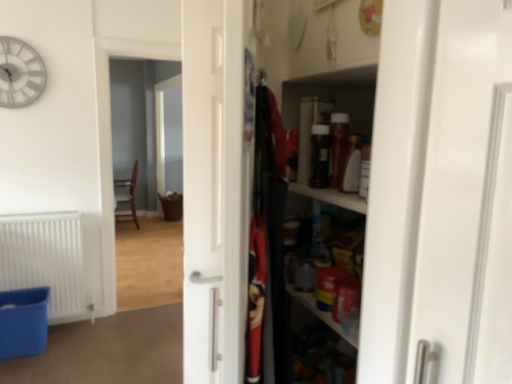
Question: From a real-world perspective, is wooden chair at center on top of brown woven basket at center?

Choices:
 (A) no
 (B) yes

Answer: (A)

Question: Can you confirm if wooden chair at center is wider than brown woven basket at center?

Choices:
 (A) no
 (B) yes

Answer: (B)

Question: Is wooden chair at center further to the viewer compared to brown woven basket at center?

Choices:
 (A) yes
 (B) no

Answer: (B)

Question: Is wooden chair at center to the left of brown woven basket at center from the viewer's perspective?

Choices:
 (A) yes
 (B) no

Answer: (B)

Question: From the image's perspective, would you say wooden chair at center is positioned over brown woven basket at center?

Choices:
 (A) yes
 (B) no

Answer: (B)

Question: Is wooden chair at center not inside brown woven basket at center?

Choices:
 (A) yes
 (B) no

Answer: (A)

Question: Can you confirm if brown woven basket at center is bigger than blue plastic laundry basket at lower left?

Choices:
 (A) no
 (B) yes

Answer: (B)

Question: Does brown woven basket at center come behind blue plastic laundry basket at lower left?

Choices:
 (A) yes
 (B) no

Answer: (A)

Question: From the image's perspective, is brown woven basket at center below blue plastic laundry basket at lower left?

Choices:
 (A) no
 (B) yes

Answer: (A)

Question: Does brown woven basket at center have a lesser width compared to blue plastic laundry basket at lower left?

Choices:
 (A) yes
 (B) no

Answer: (A)

Question: From a real-world perspective, does brown woven basket at center sit lower than blue plastic laundry basket at lower left?

Choices:
 (A) yes
 (B) no

Answer: (B)

Question: Does brown woven basket at center turn towards blue plastic laundry basket at lower left?

Choices:
 (A) no
 (B) yes

Answer: (A)

Question: Considering the relative sizes of wooden shelves at right and brown woven basket at center in the image provided, is wooden shelves at right bigger than brown woven basket at center?

Choices:
 (A) no
 (B) yes

Answer: (A)